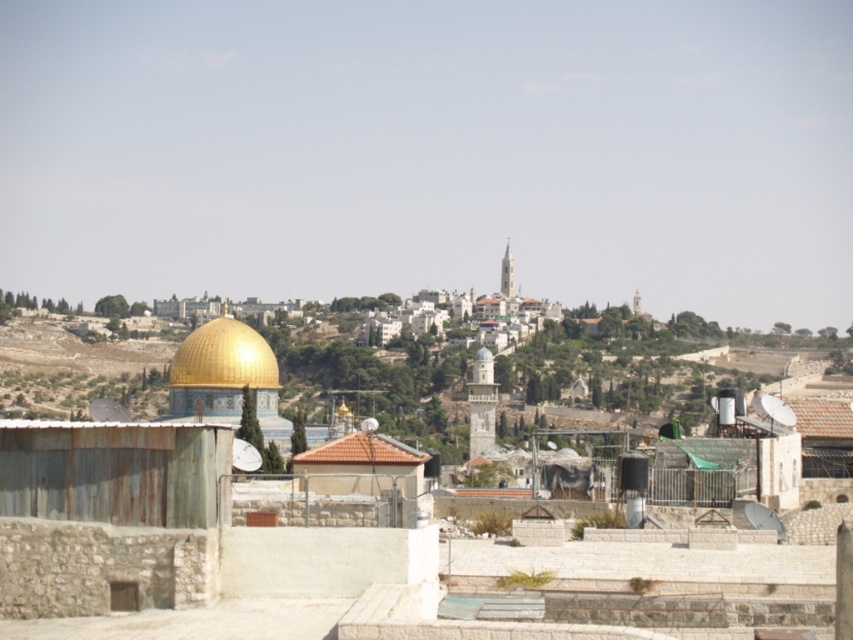
You are standing in the city of Jerusalem and see the point marked at coordinates (224,356). What does this point represent?

The point at coordinates (224,356) represents the gold shiny dome at center.

You are an architect analyzing the cityscape. Based on the image, which object, the gold shiny dome at center or the brown tile roof at center, occupies more visual space in the composition?

The gold shiny dome at center has a larger size compared to the brown tile roof at center, so it occupies more visual space in the composition.

You are standing in the city of Jerusalem, looking at the gold shiny dome at center. Based on its position in the image, can you estimate where it is located relative to the edges of the photo?

The gold shiny dome at center is located at the coordinates 0.559 on the x axis and 0.264 on the y axis, meaning it is slightly to the right and above the center point of the image.